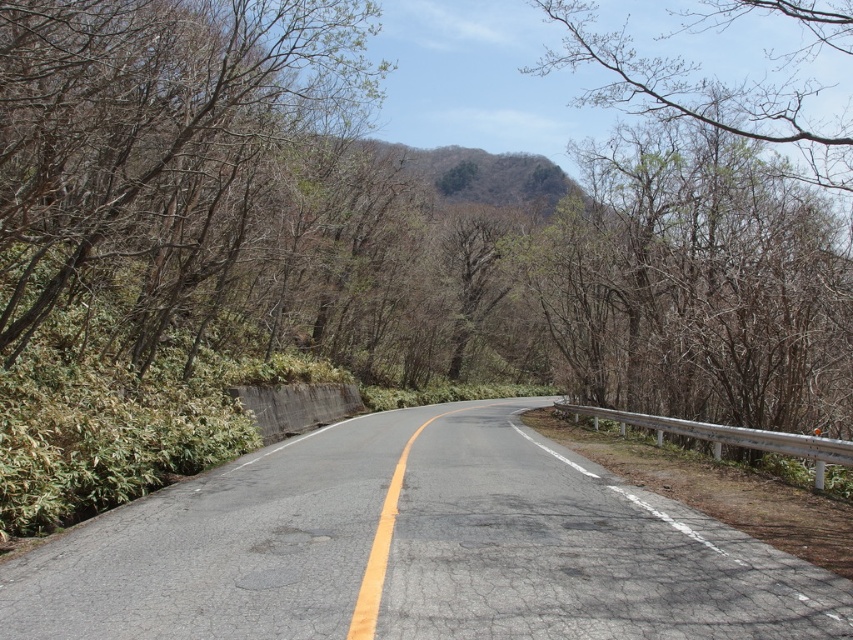
Does black asphalt road at center have a lesser height compared to brown/dry wood at left?

Yes, black asphalt road at center is shorter than brown/dry wood at left.

Does black asphalt road at center have a larger size compared to brown/dry wood at left?

No.

Measure the distance between point [640,541] and camera.

They are 6.77 meters apart.

In order to click on black asphalt road at center in this screenshot , I will do `click(415, 548)`.